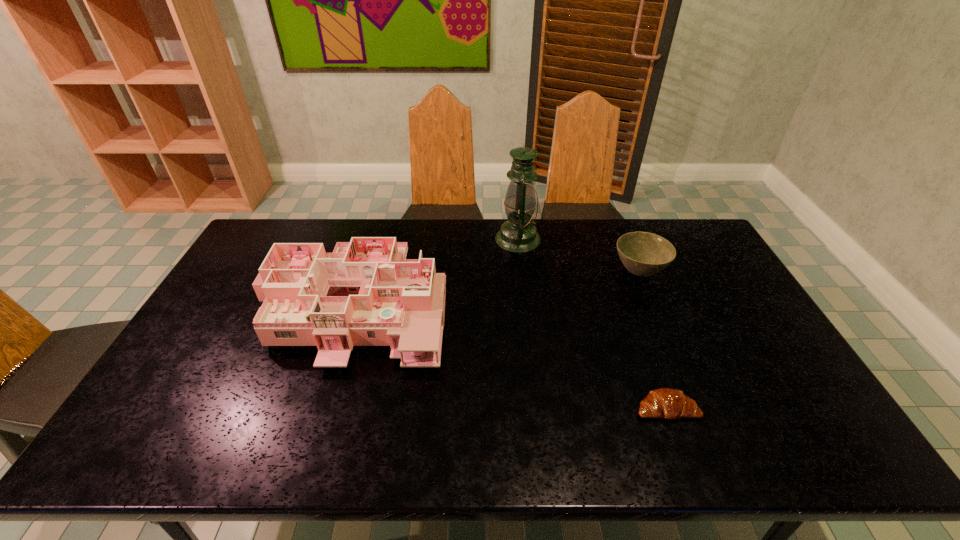
You are a GUI agent. You are given a task and a screenshot of the screen. Output one action in this format:
    pyautogui.click(x=<x>, y=<y>)
    Task: Click on the free space between the third tallest object and the second tallest object
    The height and width of the screenshot is (540, 960).
    Given the screenshot: What is the action you would take?
    pyautogui.click(x=497, y=289)

I want to click on free area in between the bowl and the shortest object, so click(x=652, y=341).

This screenshot has width=960, height=540. Identify the location of vacant region between the second object from left to right and the second tallest object. (437, 272).

Find the location of a particular element. The width and height of the screenshot is (960, 540). free space between the leftmost object and the oil lamp is located at coordinates (437, 272).

What are the coordinates of `vacant area that lies between the bowl and the third shortest object` in the screenshot? It's located at (497, 289).

Find the location of a particular element. Image resolution: width=960 pixels, height=540 pixels. free space between the third object from right to left and the bowl is located at coordinates (578, 256).

I want to click on free space that is in between the crescent roll and the dollhouse, so click(x=511, y=357).

Image resolution: width=960 pixels, height=540 pixels. What are the coordinates of `free spot between the tallest object and the leftmost object` in the screenshot? It's located at (437, 272).

Locate which object is the closest to the dollhouse. Please provide its 2D coordinates. Your answer should be formatted as a tuple, i.e. [(x, y)], where the tuple contains the x and y coordinates of a point satisfying the conditions above.

[(518, 235)]

This screenshot has height=540, width=960. I want to click on object that is the closest to the second shortest object, so click(518, 235).